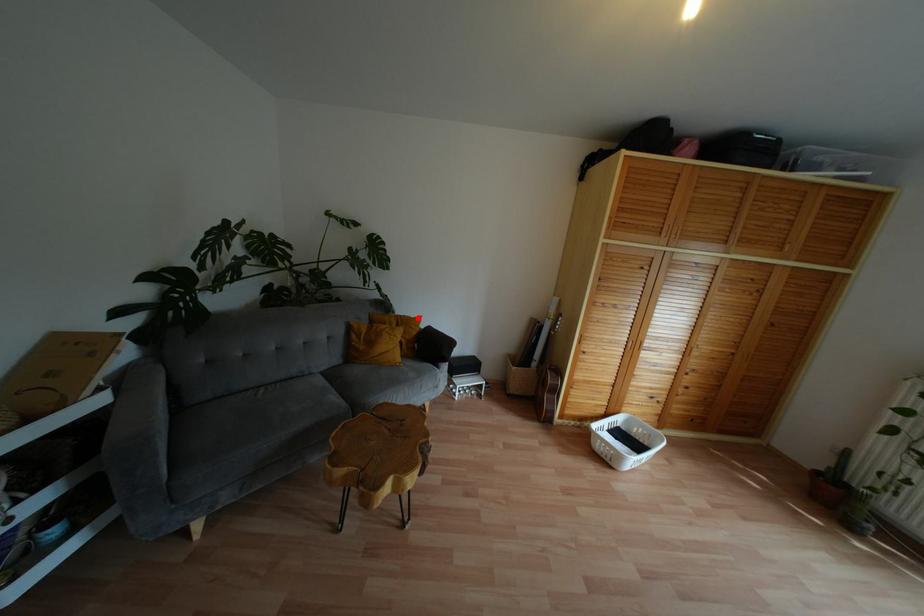
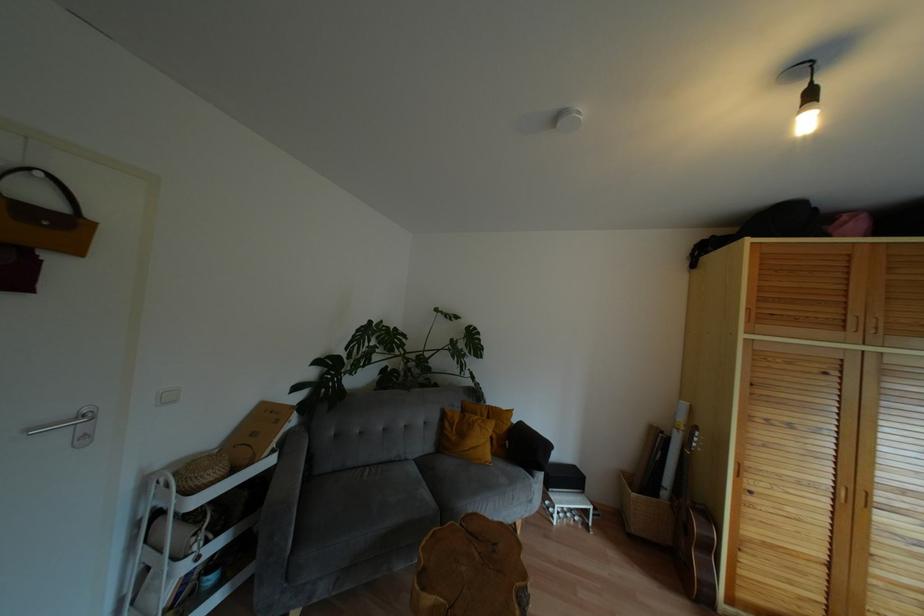
Locate, in the second image, the point that corresponds to the highlighted location in the first image.

(508, 411)